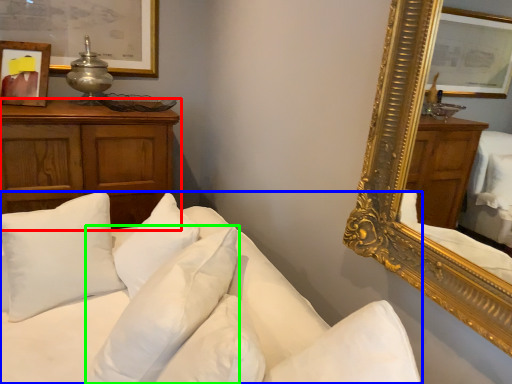
Question: Considering the real-world distances, which object is closest to cabinetry (highlighted by a red box)? studio couch (highlighted by a blue box) or pillow (highlighted by a green box).

Choices:
 (A) studio couch
 (B) pillow

Answer: (A)